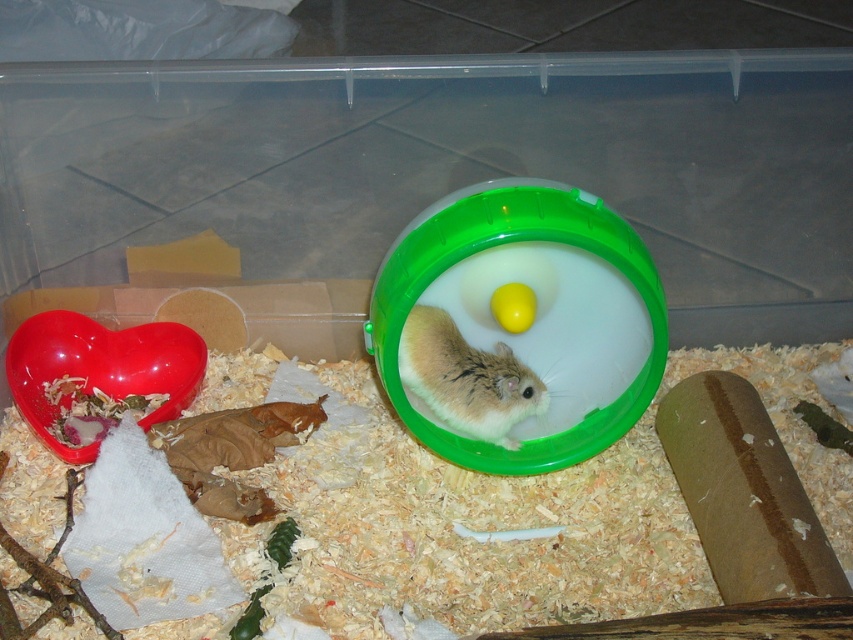
Question: Does white fur hamster at center appear on the right side of yellow matte egg at center?

Choices:
 (A) yes
 (B) no

Answer: (B)

Question: Is white fur hamster at center below yellow matte egg at center?

Choices:
 (A) yes
 (B) no

Answer: (A)

Question: Does white fur hamster at center come in front of yellow matte egg at center?

Choices:
 (A) yes
 (B) no

Answer: (B)